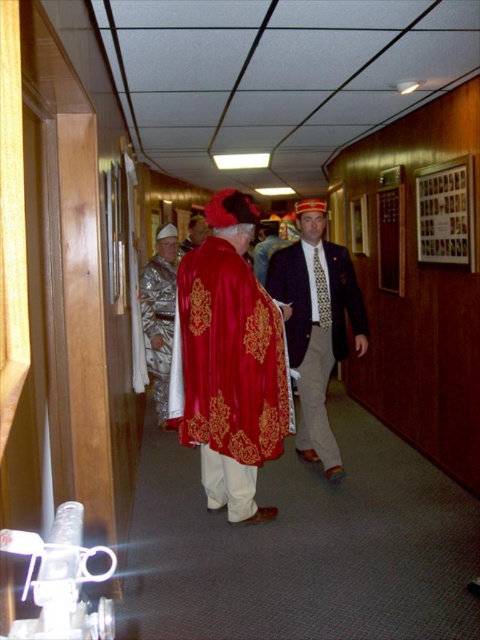
Does velvet suit at center appear on the left side of velvet gold robe at center?

No, velvet suit at center is not to the left of velvet gold robe at center.

Where is `velvet suit at center`? velvet suit at center is located at coordinates 316,323.

Who is more distant from viewer, (x=291, y=340) or (x=166, y=300)?

Positioned behind is point (x=166, y=300).

I want to click on velvet suit at center, so click(316, 323).

Who is positioned more to the left, velvet gold at center or velvet red cape at center?

From the viewer's perspective, velvet red cape at center appears more on the left side.

Is velvet gold at center to the left of velvet red cape at center from the viewer's perspective?

No, velvet gold at center is not to the left of velvet red cape at center.

Does point (253, 298) come in front of point (196, 244)?

Yes, it is in front of point (196, 244).

Identify the location of velvet gold at center. The image size is (480, 640). (228, 372).

Does velvet gold at center have a smaller size compared to velvet suit at center?

Indeed, velvet gold at center has a smaller size compared to velvet suit at center.

Looking at this image, between velvet gold at center and velvet suit at center, which one is positioned lower?

Positioned lower is velvet gold at center.

Which is in front, point (276, 433) or point (342, 316)?

Positioned in front is point (276, 433).

You are a GUI agent. You are given a task and a screenshot of the screen. Output one action in this format:
    pyautogui.click(x=<x>, y=<y>)
    Task: Click on the velvet gold at center
    
    Given the screenshot: What is the action you would take?
    pyautogui.click(x=228, y=372)